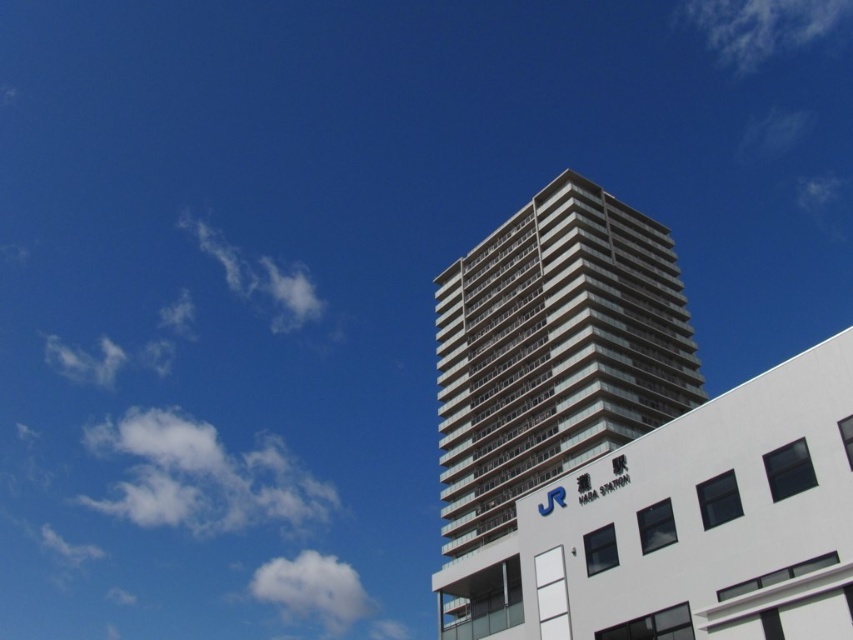
Question: Among these points, which one is farthest from the camera?

Choices:
 (A) (186, 218)
 (B) (210, 470)

Answer: (B)

Question: Which point is closer to the camera?

Choices:
 (A) (548, 356)
 (B) (271, 260)

Answer: (A)

Question: Which point is closer to the camera?

Choices:
 (A) glassy concrete tower at center
 (B) white fluffy cloud at upper right
 (C) white fluffy cloud at upper left

Answer: (A)

Question: Is the position of glassy concrete tower at center less distant than that of white fluffy cloud at upper right?

Choices:
 (A) yes
 (B) no

Answer: (A)

Question: Is glassy concrete tower at center positioned behind white fluffy cloud at upper left?

Choices:
 (A) no
 (B) yes

Answer: (A)

Question: Can you confirm if white fluffy cloud at upper right is smaller than white fluffy cloud at upper left?

Choices:
 (A) no
 (B) yes

Answer: (A)